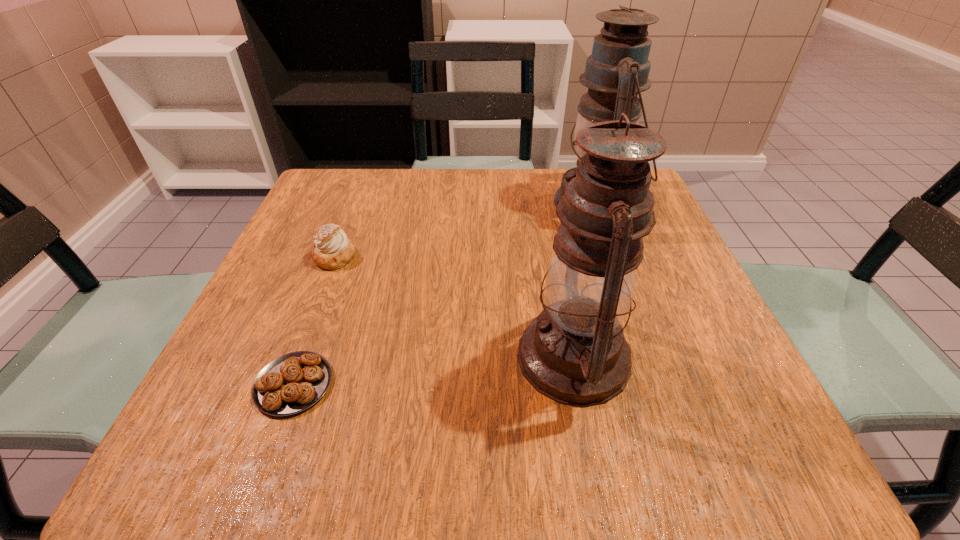
The image size is (960, 540). In order to click on free space at the far left corner of the desktop in this screenshot , I will do `click(361, 184)`.

Locate an element on the screen. This screenshot has width=960, height=540. vacant space at the near right corner of the desktop is located at coordinates (793, 456).

This screenshot has width=960, height=540. Find the location of `unoccupied area between the taller pastry and the nearer oil lamp`. unoccupied area between the taller pastry and the nearer oil lamp is located at coordinates (454, 307).

Find the location of `free space between the shorter pastry and the second shortest object`. free space between the shorter pastry and the second shortest object is located at coordinates (314, 321).

Identify the location of vacant space that's between the shorter pastry and the nearer oil lamp. (434, 371).

At what (x,y) coordinates should I click in order to perform the action: click on free spot between the farther pastry and the farther oil lamp. Please return your answer as a coordinate pair (x, y). Looking at the image, I should click on (465, 231).

Locate an element on the screen. The width and height of the screenshot is (960, 540). vacant point located between the farthest object and the farther pastry is located at coordinates (465, 231).

In order to click on vacant area that lies between the farthest object and the farther pastry in this screenshot , I will do `click(465, 231)`.

The height and width of the screenshot is (540, 960). I want to click on vacant space in between the taller pastry and the shortest object, so click(314, 321).

Locate an element on the screen. The image size is (960, 540). vacant point located between the nearer oil lamp and the shorter pastry is located at coordinates (434, 371).